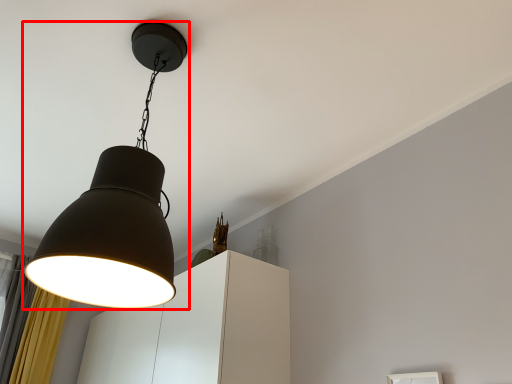
Question: From the image, what is the correct spatial relationship of lamp (annotated by the red box) in relation to cabinetry?

Choices:
 (A) right
 (B) left

Answer: (A)